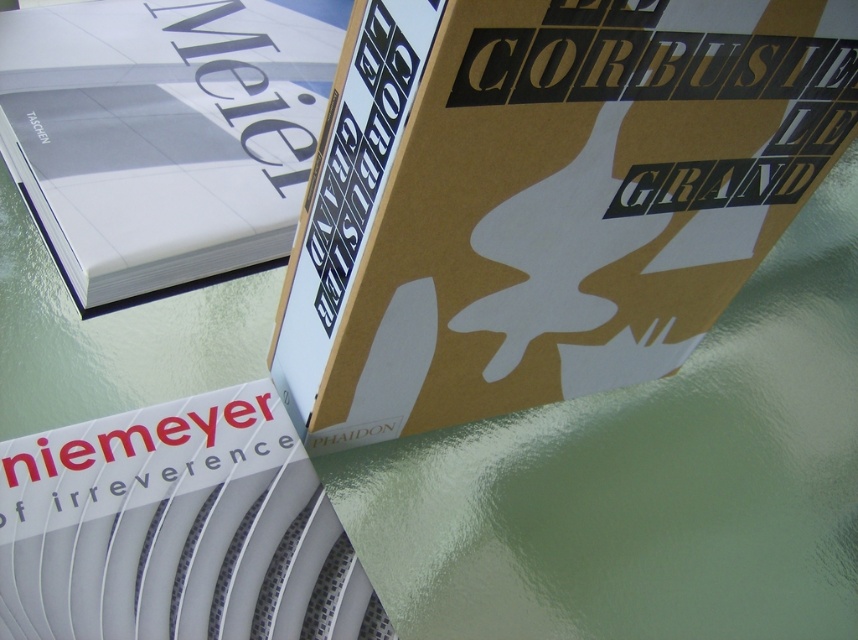
What is the color of the book located at point (x=164, y=132)?

The book at point (x=164, y=132) is matte white.

Where is the matte white book at upper left located in the image?

Result: The matte white book at upper left is located at point (164, 132).

What is the color of the book located at point (544, 196)?

The book at point (544, 196) is gold matte.